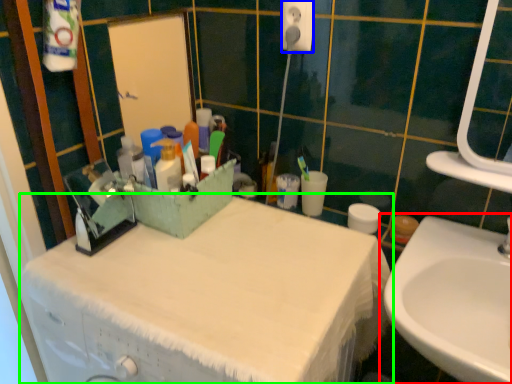
Question: Which object is positioned farthest from sink (highlighted by a red box)? Select from electric outlet (highlighted by a blue box) and bathroom cabinet (highlighted by a green box).

Choices:
 (A) electric outlet
 (B) bathroom cabinet

Answer: (A)